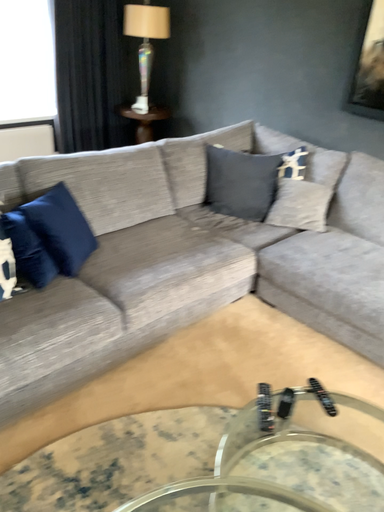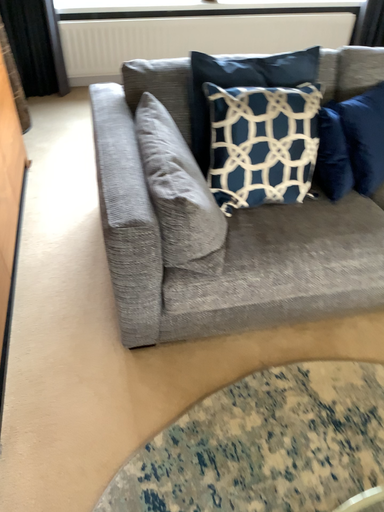
Question: Which way did the camera rotate in the video?

Choices:
 (A) rotated upward
 (B) rotated downward

Answer: (B)